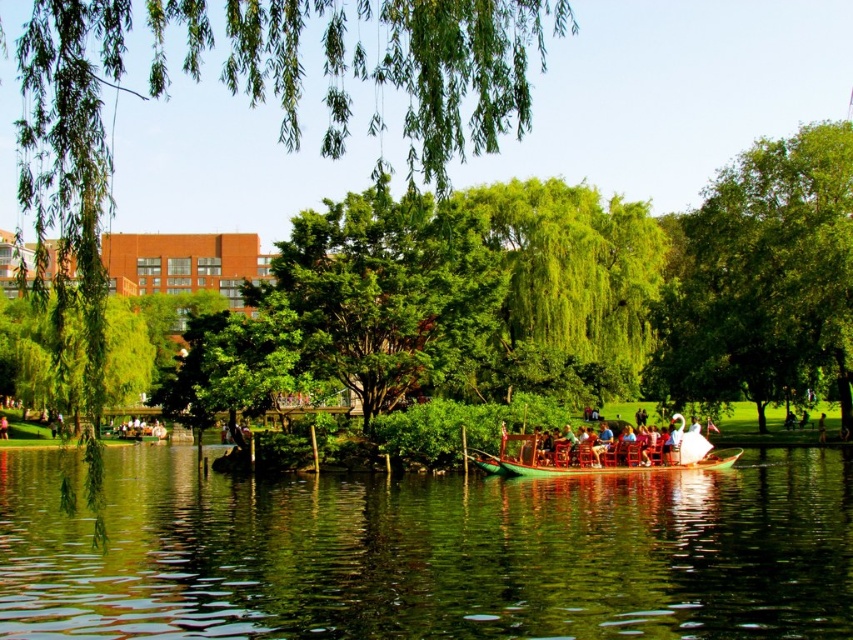
Question: Can you confirm if green leafy tree at center is thinner than green wooden boat at center?

Choices:
 (A) no
 (B) yes

Answer: (A)

Question: Which object is positioned closest to the green polished wood boat at center?

Choices:
 (A) green leafy tree at center
 (B) green wooden boat at center

Answer: (B)

Question: Which object appears closest to the camera in this image?

Choices:
 (A) green wooden boat at center
 (B) green polished wood boat at center
 (C) green leafy tree at center
 (D) green leafy tree at upper right

Answer: (C)

Question: Estimate the real-world distances between objects in this image. Which object is closer to the green leafy tree at center?

Choices:
 (A) green leafy tree at upper right
 (B) green polished wood boat at center

Answer: (A)

Question: Can you confirm if green polished wood boat at center is bigger than green leafy tree at upper right?

Choices:
 (A) no
 (B) yes

Answer: (A)

Question: Can you confirm if green polished wood boat at center is positioned above green wooden boat at center?

Choices:
 (A) yes
 (B) no

Answer: (B)